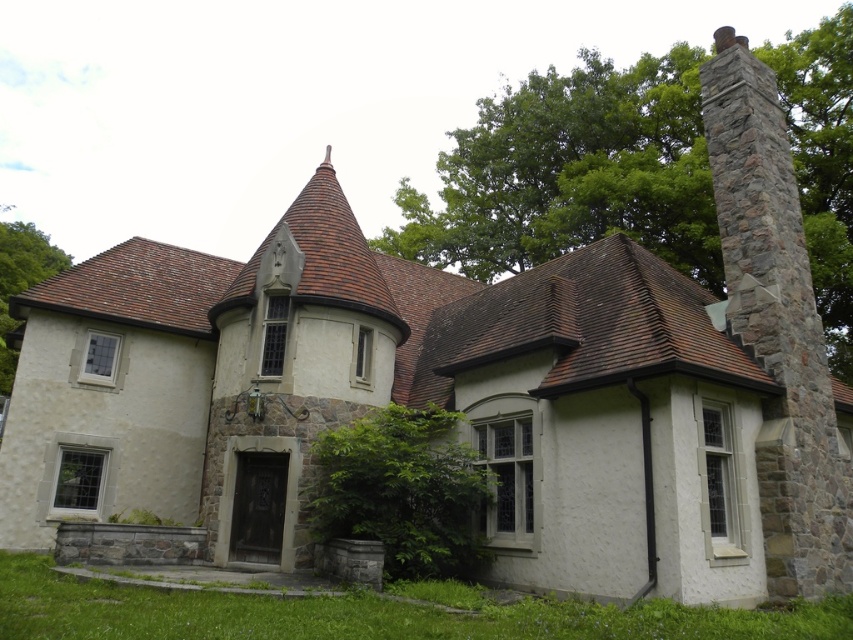
Question: Among these objects, which one is nearest to the camera?

Choices:
 (A) green leafy tree at lower center
 (B) green leafy tree at upper left

Answer: (A)

Question: Is green leafy tree at upper right wider than green leafy tree at lower center?

Choices:
 (A) yes
 (B) no

Answer: (A)

Question: Can you confirm if green leafy tree at lower center is smaller than green leafy tree at upper left?

Choices:
 (A) no
 (B) yes

Answer: (B)

Question: Based on their relative distances, which object is farther from the green leafy tree at upper left?

Choices:
 (A) green leafy tree at lower center
 (B) green leafy tree at upper right

Answer: (B)

Question: Does green leafy tree at lower center have a greater width compared to green leafy tree at upper left?

Choices:
 (A) no
 (B) yes

Answer: (A)

Question: Among these points, which one is farthest from the camera?

Choices:
 (A) (393, 412)
 (B) (524, 154)
 (C) (22, 278)

Answer: (C)